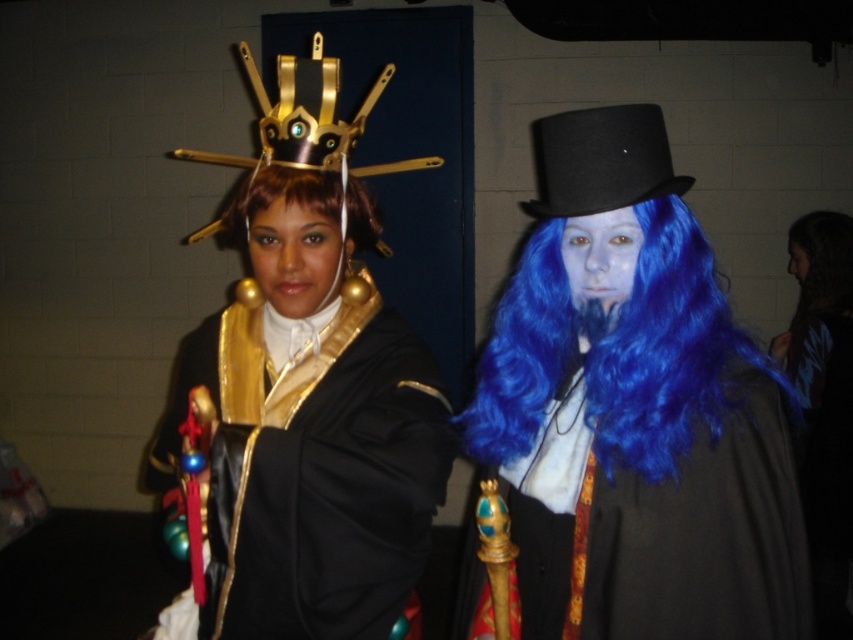
Question: Does black satin robe at center have a lesser width compared to pale matte face at center?

Choices:
 (A) no
 (B) yes

Answer: (A)

Question: Estimate the real-world distances between objects in this image. Which object is farther from the matte gold crown at center?

Choices:
 (A) brown shiny hair at center
 (B) blue synthetic wig at right

Answer: (B)

Question: Which of the following is the farthest from the observer?

Choices:
 (A) matte gold crown at center
 (B) blue synthetic wig at right
 (C) blue matte wig at center

Answer: (C)

Question: Can you confirm if pale matte face at center is smaller than brown shiny hair at center?

Choices:
 (A) no
 (B) yes

Answer: (B)

Question: Observing the image, what is the correct spatial positioning of black felt top hat at upper right in reference to brown straight hair at upper right?

Choices:
 (A) left
 (B) right

Answer: (A)

Question: Which point appears farthest from the camera in this image?

Choices:
 (A) (621, 257)
 (B) (683, 397)
 (C) (811, 316)

Answer: (C)